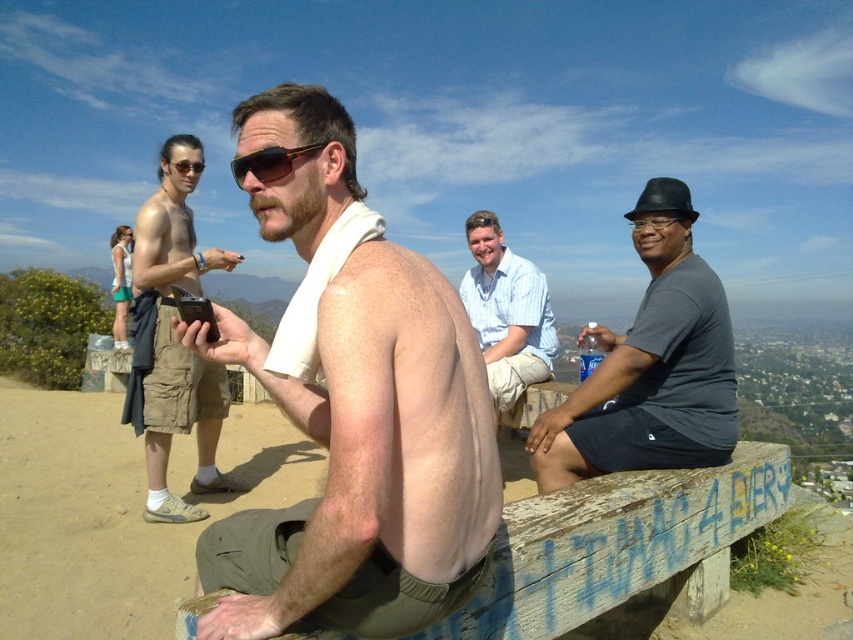
Where is the shiny skin torso at center located in the image?

The shiny skin torso at center is located at point 0.723 on the x axis and 0.429 on the y axis.

You are a photographer trying to capture the shiny skin torso at center in the image. The camera you are using has a fixed focus point set at coordinate point (364, 461). Will this focus point successfully capture the shiny skin torso at center?

Yes, the focus point at (364, 461) corresponds to the shiny skin torso at center, so it will successfully capture it.